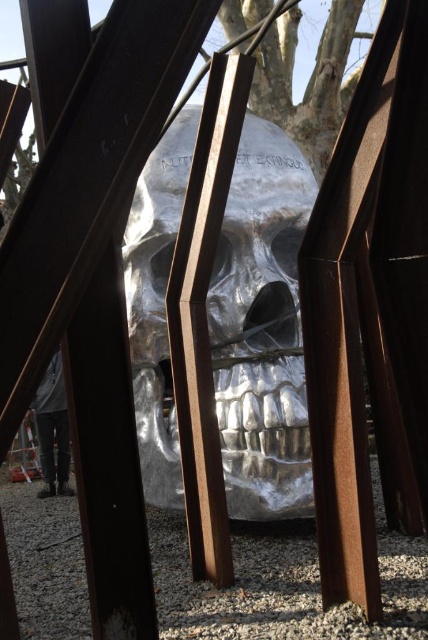
Does metallic silver skull at center have a greater width compared to gray fabric pants at lower left?

Correct, the width of metallic silver skull at center exceeds that of gray fabric pants at lower left.

What do you see at coordinates (261, 328) in the screenshot? I see `metallic silver skull at center` at bounding box center [261, 328].

The height and width of the screenshot is (640, 428). Describe the element at coordinates (261, 328) in the screenshot. I see `metallic silver skull at center` at that location.

Where is `metallic silver skull at center`? metallic silver skull at center is located at coordinates (261, 328).